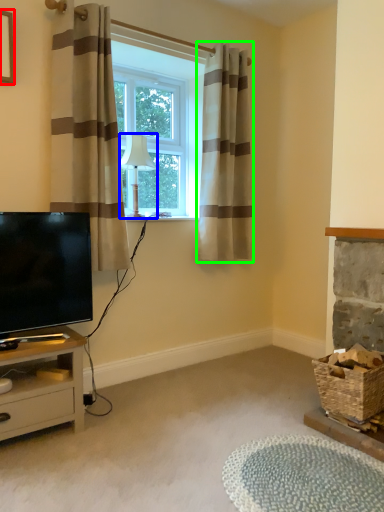
Question: Estimate the real-world distances between objects in this image. Which object is farther from picture frame (highlighted by a red box), lamp (highlighted by a blue box) or curtain (highlighted by a green box)?

Choices:
 (A) lamp
 (B) curtain

Answer: (B)